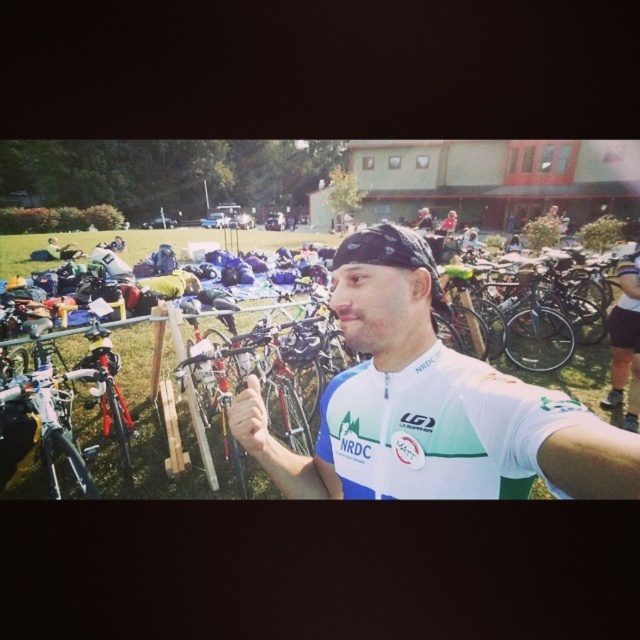
Is white matte hand at center above matte black helmet at center?

No, white matte hand at center is not above matte black helmet at center.

Who is higher up, white matte hand at center or matte black helmet at center?

matte black helmet at center

Find the location of a particular element. white matte hand at center is located at coordinates (250, 420).

At what (x,y) coordinates should I click in order to perform the action: click on white matte hand at center. Please return your answer as a coordinate pair (x, y). The image size is (640, 640). Looking at the image, I should click on (250, 420).

The height and width of the screenshot is (640, 640). I want to click on white jersey at center, so point(436,403).

Which is behind, point (292, 483) or point (257, 417)?

Point (292, 483)

Locate an element on the screen. The image size is (640, 640). white jersey at center is located at coordinates (436, 403).

Based on the photo, is white jersey at center taller than matte black helmet at center?

Yes, white jersey at center is taller than matte black helmet at center.

Can you confirm if white jersey at center is bigger than matte black helmet at center?

Yes, white jersey at center is bigger than matte black helmet at center.

The height and width of the screenshot is (640, 640). Describe the element at coordinates (436, 403) in the screenshot. I see `white jersey at center` at that location.

Where is `white jersey at center`? The width and height of the screenshot is (640, 640). white jersey at center is located at coordinates (436, 403).